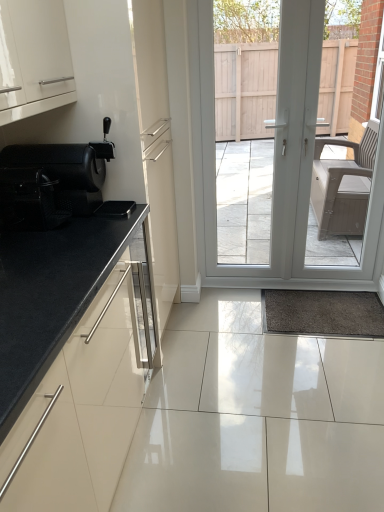
Question: From the image's perspective, is black granite countertop at left positioned above or below white glossy door at center?

Choices:
 (A) above
 (B) below

Answer: (B)

Question: Choose the correct answer: Is black granite countertop at left inside white glossy door at center or outside it?

Choices:
 (A) inside
 (B) outside

Answer: (B)

Question: Estimate the real-world distances between objects in this image. Which object is farther from the black granite countertop at left?

Choices:
 (A) black mesh chair at left
 (B) white glossy door at center

Answer: (B)

Question: Based on their relative distances, which object is farther from the black mesh chair at left?

Choices:
 (A) white glossy door at center
 (B) black granite countertop at left

Answer: (A)